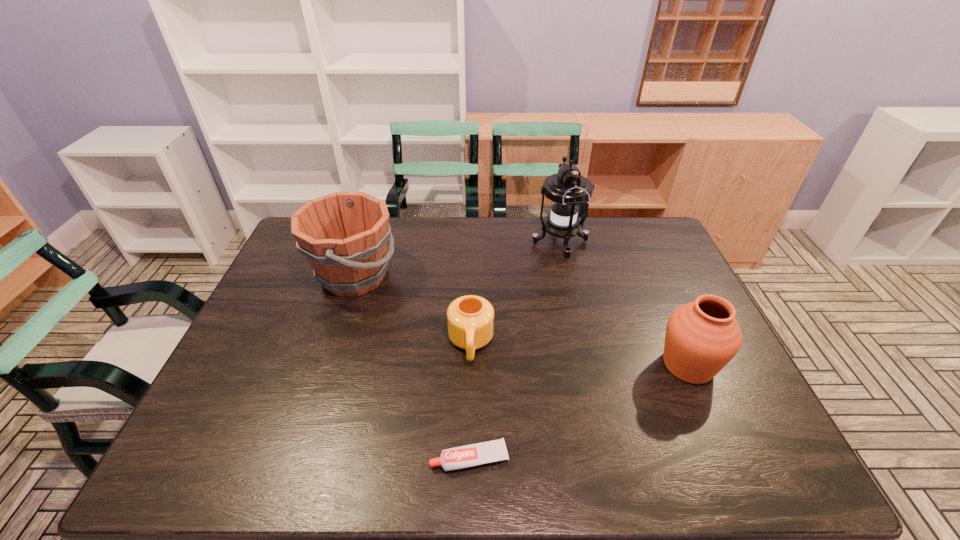
Find the location of a particular element. lantern is located at coordinates (567, 190).

At what (x,y) coordinates should I click in order to perform the action: click on the fourth object from left to right. Please return your answer as a coordinate pair (x, y). This screenshot has width=960, height=540. Looking at the image, I should click on (567, 190).

Image resolution: width=960 pixels, height=540 pixels. Identify the location of the leftmost object. (344, 235).

Where is `the rightmost object`? The width and height of the screenshot is (960, 540). the rightmost object is located at coordinates (702, 337).

At what (x,y) coordinates should I click in order to perform the action: click on mug. Please return your answer as a coordinate pair (x, y). Looking at the image, I should click on tap(470, 319).

The width and height of the screenshot is (960, 540). I want to click on the shortest object, so click(471, 455).

The height and width of the screenshot is (540, 960). What are the coordinates of `the nearest object` in the screenshot? It's located at (471, 455).

Find the location of a particular element. The image size is (960, 540). free space located 0.220m on the right of the lantern is located at coordinates (651, 243).

At what (x,y) coordinates should I click in order to perform the action: click on vacant space located 0.180m on the handle side of the leftmost object. Please return your answer as a coordinate pair (x, y). This screenshot has width=960, height=540. Looking at the image, I should click on (455, 276).

Locate an element on the screen. vacant space located on the back of the rightmost object is located at coordinates (668, 320).